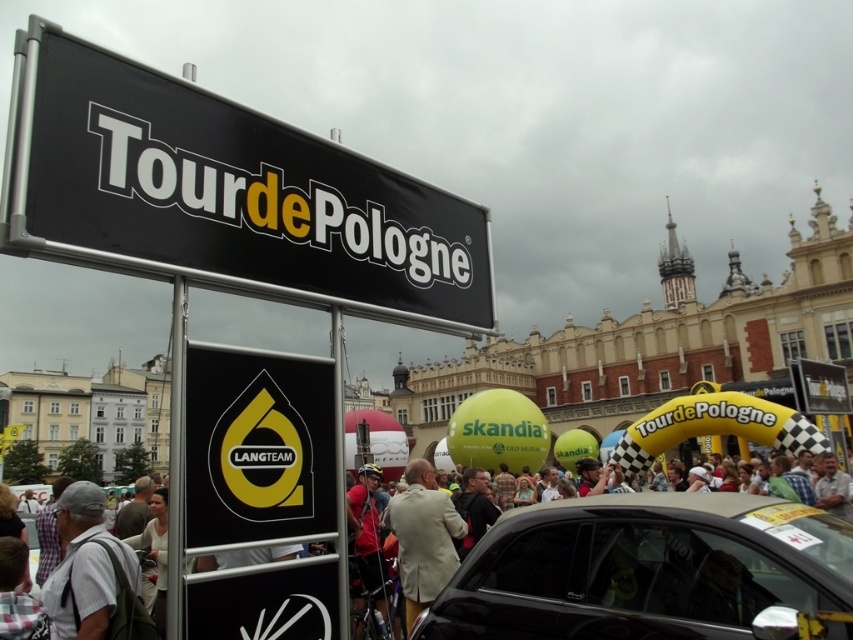
You are a photographer at the event and want to capture a clear shot of the black matte sign at upper left without any obstructions. The gray fabric shirt at lower left is in your way. Can you adjust your angle to avoid the shirt while still keeping the sign in frame?

The black matte sign at upper left is positioned over the gray fabric shirt at lower left, so adjusting the angle slightly upward should keep the sign in frame while avoiding the shirt.

You are a photographer at the event and need to capture both the black glossy car at center and the yellow matte sign at center in a single frame. Given that your camera has a fixed focal length, which object should you position closer to ensure both are visible without zooming?

Since the black glossy car at center is bigger than the yellow matte sign at center, you should position the larger black glossy car at center farther away and the smaller yellow matte sign at center closer to the camera to maintain visibility of both in the frame.

You are a photographer standing at the event and want to capture both the gray fabric shirt at lower left and the light beige suit at center in the same frame. Given that your camera has a maximum focus range of 15 meters, will you be able to include both subjects in a single photo?

The distance between the gray fabric shirt at lower left and the light beige suit at center is 16.76 meters, which exceeds the camera focus range of 15 meters. Therefore, you cannot capture both in a single photo with the current settings.